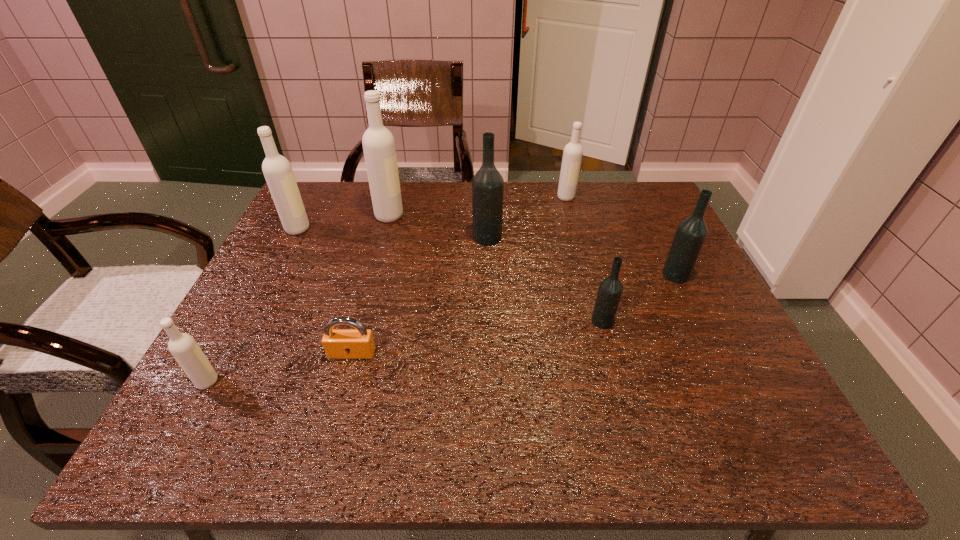
Where is `the third closest object to the sixth farthest object`? the third closest object to the sixth farthest object is located at coordinates (572, 155).

Where is `the closest object to the leftmost black vodka`? This screenshot has width=960, height=540. the closest object to the leftmost black vodka is located at coordinates (378, 142).

At what (x,y) coordinates should I click in order to perform the action: click on vodka that can be found as the sixth closest to the fifth object from left to right. Please return your answer as a coordinate pair (x, y). Image resolution: width=960 pixels, height=540 pixels. Looking at the image, I should click on (183, 347).

Point out which vodka is positioned as the second nearest to the smallest white vodka. Please provide its 2D coordinates. Your answer should be formatted as a tuple, i.e. [(x, y)], where the tuple contains the x and y coordinates of a point satisfying the conditions above.

[(378, 142)]

You are a GUI agent. You are given a task and a screenshot of the screen. Output one action in this format:
    pyautogui.click(x=<x>, y=<y>)
    Task: Click on the white vodka that is the third closest to the rightmost white vodka
    The width and height of the screenshot is (960, 540).
    Given the screenshot: What is the action you would take?
    pyautogui.click(x=183, y=347)

The width and height of the screenshot is (960, 540). In order to click on the second closest white vodka relative to the second biggest white vodka in this screenshot , I will do `click(183, 347)`.

Locate an element on the screen. The image size is (960, 540). black vodka that is the nearest to the smallest white vodka is located at coordinates (488, 184).

Locate which black vodka ranks second in proximity to the sixth farthest object. Please provide its 2D coordinates. Your answer should be formatted as a tuple, i.e. [(x, y)], where the tuple contains the x and y coordinates of a point satisfying the conditions above.

[(488, 184)]

You are a GUI agent. You are given a task and a screenshot of the screen. Output one action in this format:
    pyautogui.click(x=<x>, y=<y>)
    Task: Click on the free location that satisfies the following two spatial constraints: 1. on the front side of the tallest vodka; 2. on the right side of the second black vodka from left to right
    The image size is (960, 540).
    Given the screenshot: What is the action you would take?
    pyautogui.click(x=361, y=321)